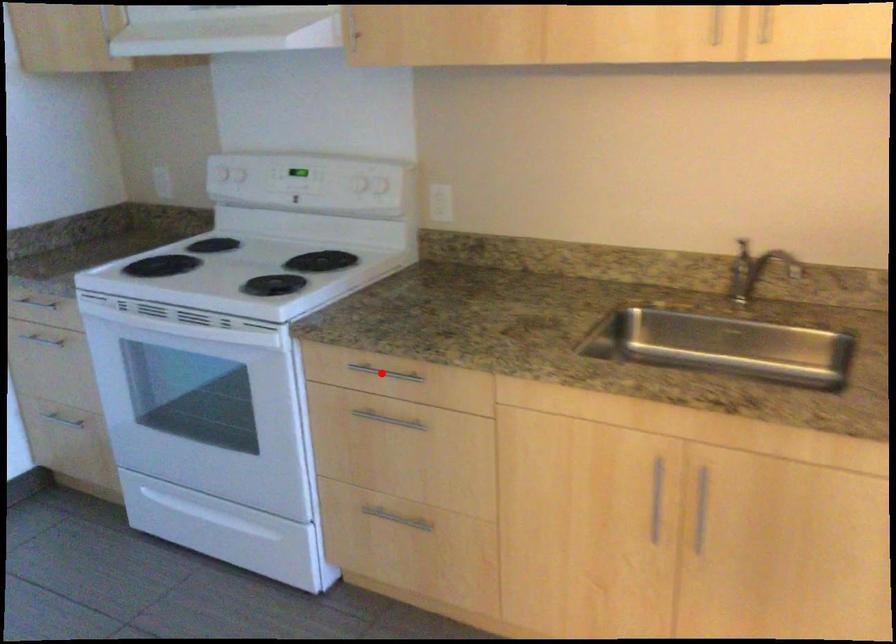
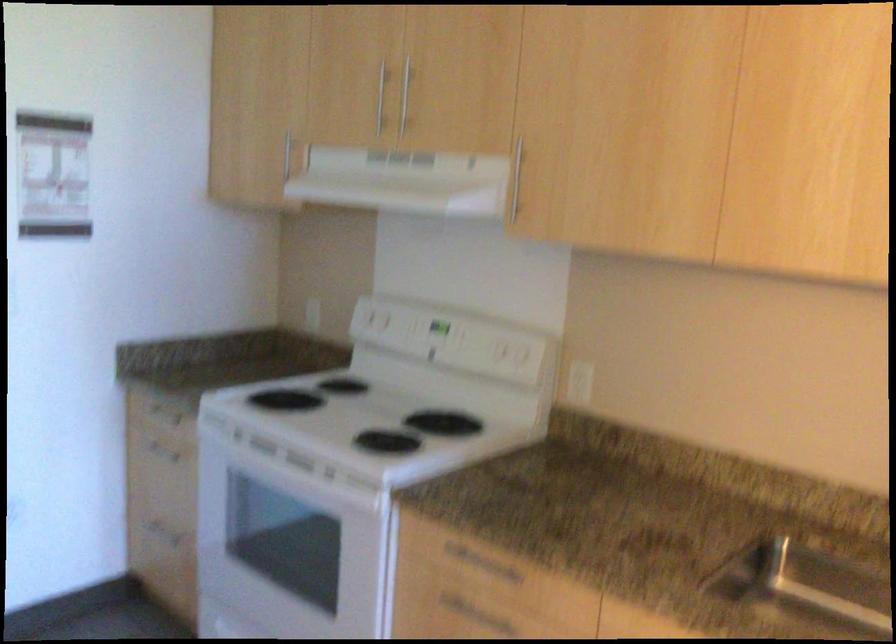
Question: I am providing you with two images of the same scene from different viewpoints. A red point is shown in image1. For the corresponding object point in image2, is it positioned nearer or farther from the camera?

Choices:
 (A) Nearer
 (B) Farther

Answer: (A)